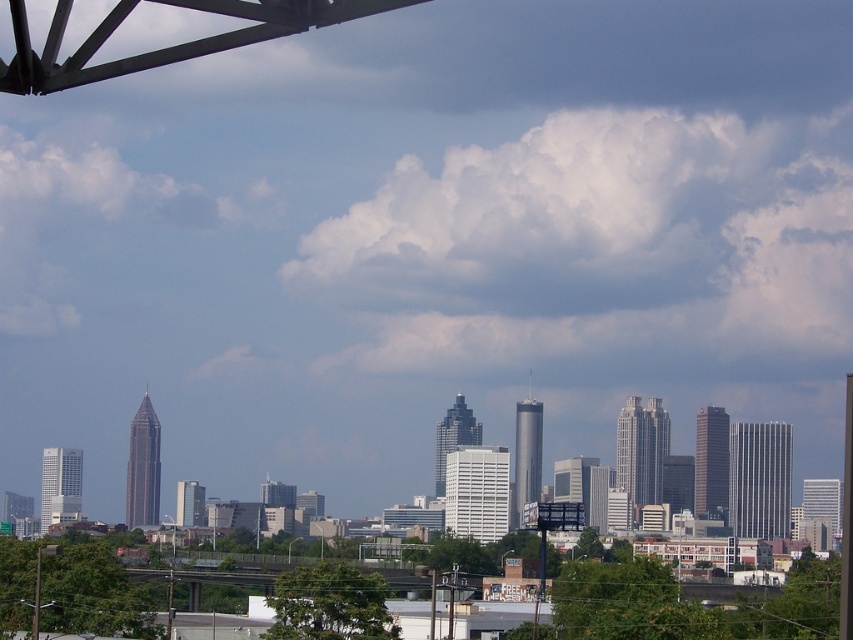
Consider the image. Does white fluffy cloud at upper center have a smaller size compared to white fluffy cloud at upper left?

Incorrect, white fluffy cloud at upper center is not smaller in size than white fluffy cloud at upper left.

Find the location of a particular element. This screenshot has width=853, height=640. white fluffy cloud at upper center is located at coordinates (596, 246).